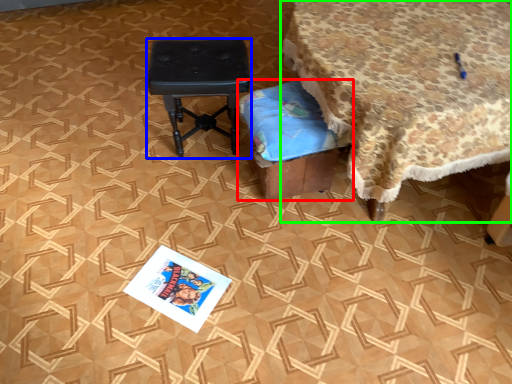
Question: Considering the real-world distances, which object is closest to furniture (highlighted by a red box)? stool (highlighted by a blue box) or table (highlighted by a green box).

Choices:
 (A) stool
 (B) table

Answer: (B)